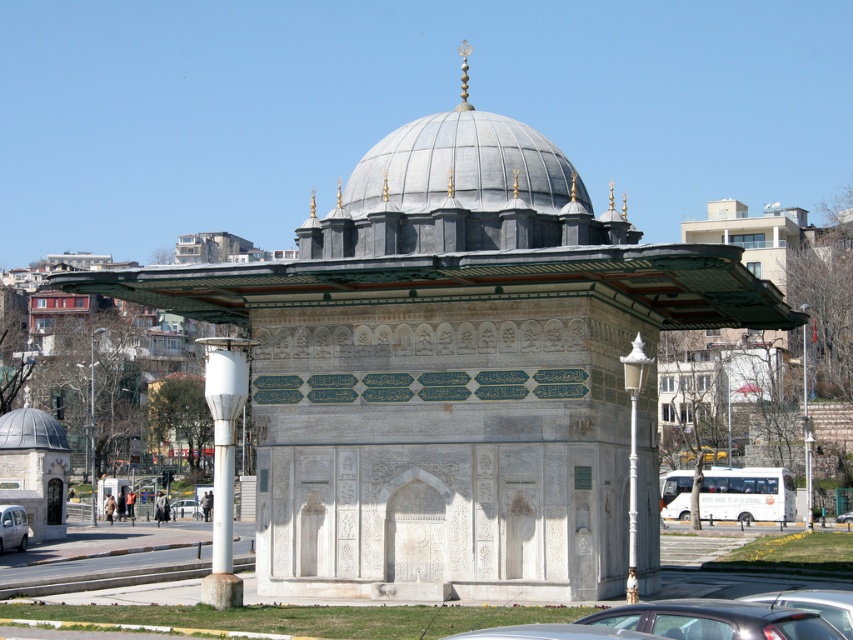
Does shiny black car at center have a greater height compared to metallic silver car at center?

Correct, shiny black car at center is much taller as metallic silver car at center.

Measure the distance from shiny black car at center to metallic silver car at center.

shiny black car at center is 58.11 meters from metallic silver car at center.

I want to click on shiny black car at center, so click(814, 604).

In the scene shown: Can you confirm if gray stone dome at center is positioned above shiny black car at center?

Yes.

Who is shorter, gray stone dome at center or shiny black car at center?

Standing shorter between the two is shiny black car at center.

Is point (434, 224) positioned after point (820, 608)?

Yes, point (434, 224) is farther from viewer.

Identify the location of gray stone dome at center. (460, 193).

Who is lower down, metallic gray sedan at lower center or silver metallic car at lower left?

silver metallic car at lower left

Measure the distance between point (827, 621) and camera.

They are 32.84 meters apart.

Find the location of a particular element. The width and height of the screenshot is (853, 640). metallic gray sedan at lower center is located at coordinates (714, 620).

Where is `metallic gray sedan at lower center`? The width and height of the screenshot is (853, 640). metallic gray sedan at lower center is located at coordinates (714, 620).